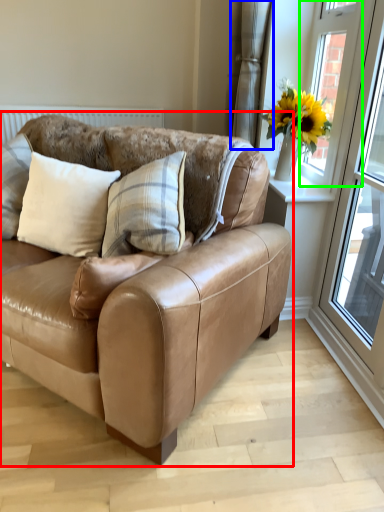
Question: Estimate the real-world distances between objects in this image. Which object is closer to studio couch (highlighted by a red box), curtain (highlighted by a blue box) or window (highlighted by a green box)?

Choices:
 (A) curtain
 (B) window

Answer: (B)